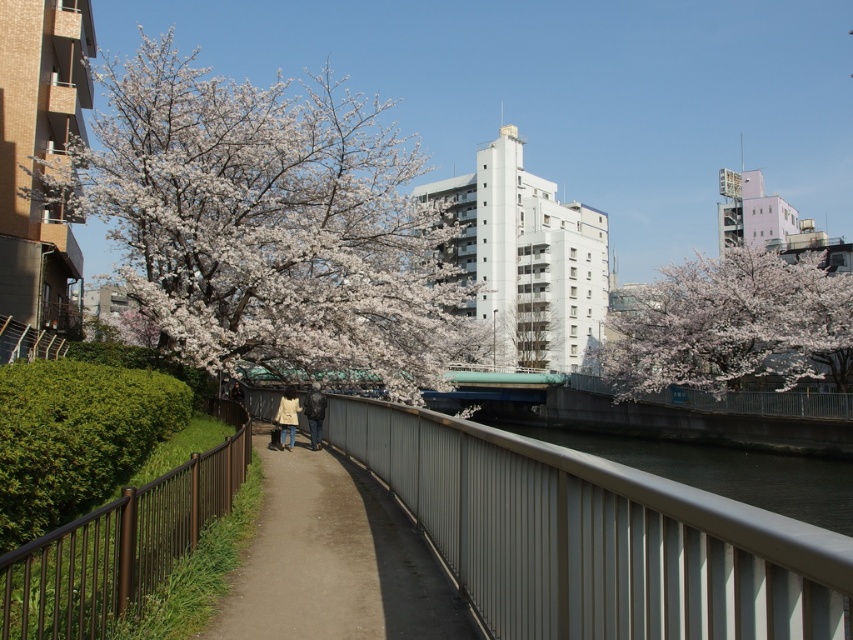
You are a photographer standing on the brown concrete path at center. You want to capture a shot of the white blossoms at upper left. Which direction should you face to ensure the blossoms are in the frame?

You should face to the left because the white blossoms at upper left are located to the left of the brown concrete path at center where you are standing.

You are a delivery drone flying over the urban scene. You need to land on the brown concrete path at center. However, you must avoid the metallic gray waterway at center. Based on their heights, which one is safer to land on?

The brown concrete path at center is not as tall as the metallic gray waterway at center, so the drone should land on the brown concrete path at center since it is lower and safer for landing.